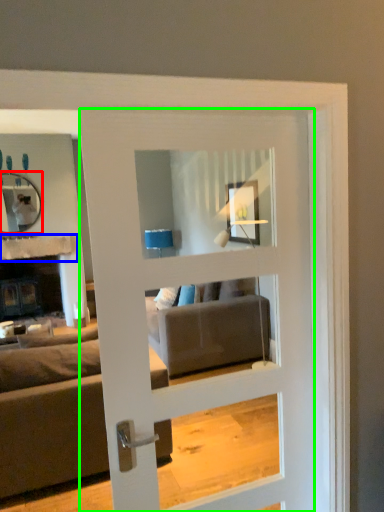
Question: Which is farther away from mirror (highlighted by a red box)? balustrade (highlighted by a blue box) or door (highlighted by a green box)?

Choices:
 (A) balustrade
 (B) door

Answer: (B)